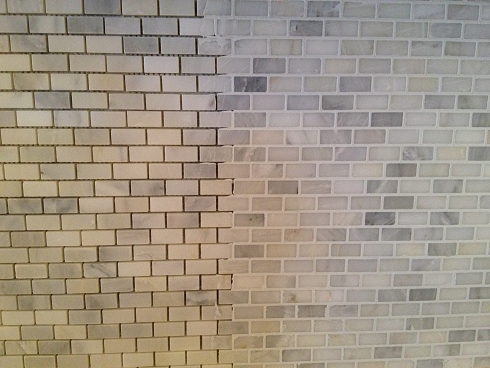
I want to click on white grout, so pyautogui.click(x=283, y=231).